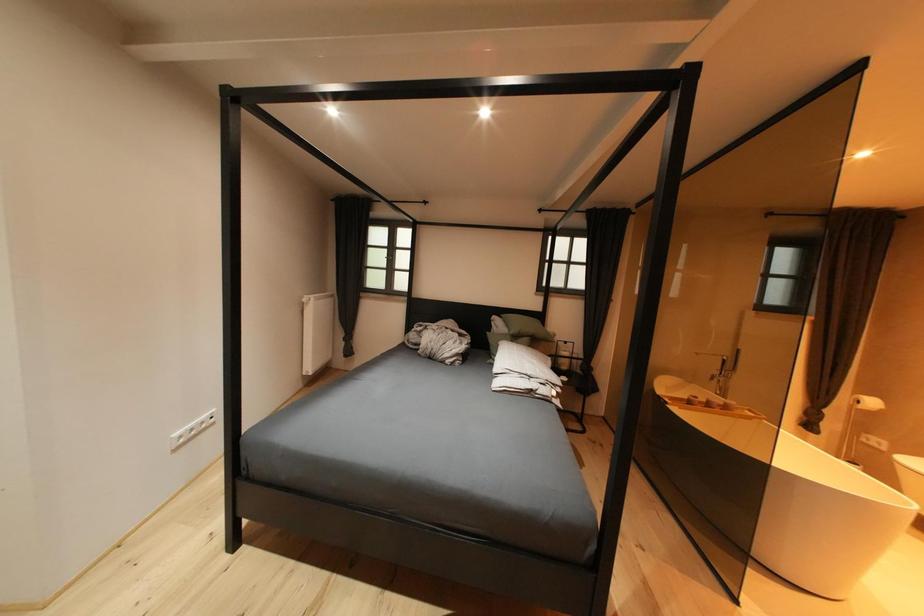
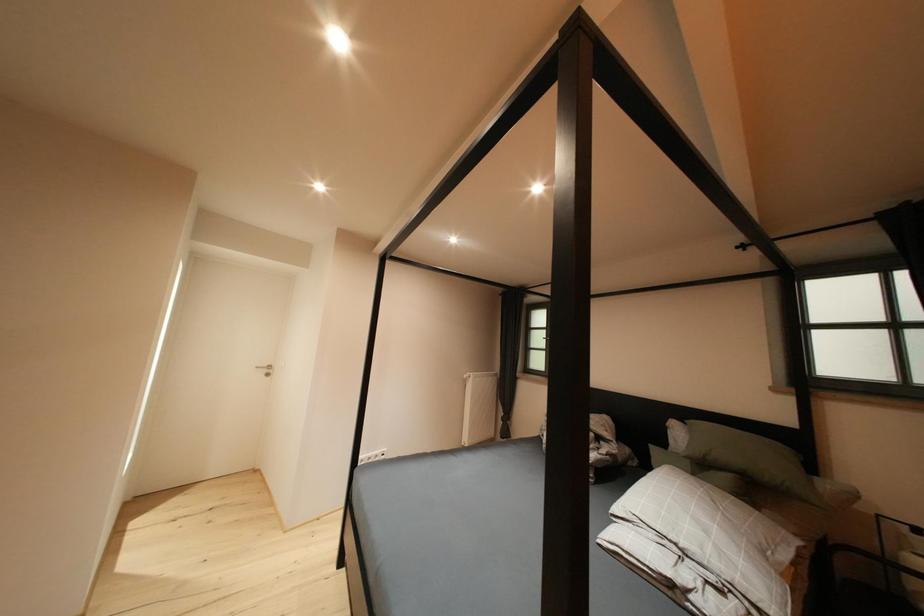
The first image is from the beginning of the video and the second image is from the end. How did the camera likely rotate when shooting the video?

The rotation direction of the camera is left-up.